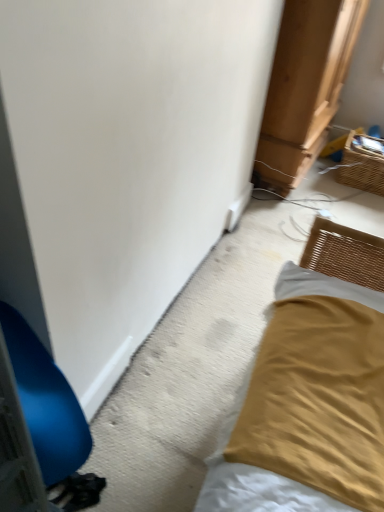
Find the location of a particular element. free point above woven brown basket at upper right (from a real-world perspective) is located at coordinates [372, 142].